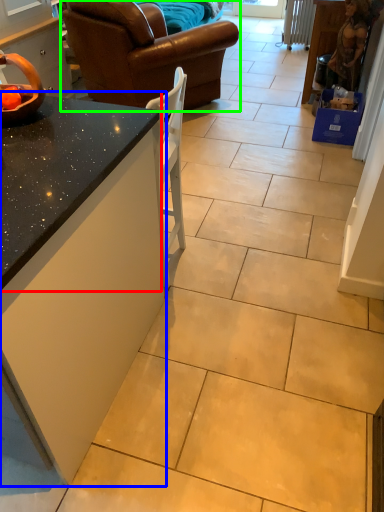
Question: Which is nearer to the countertop (highlighted by a red box)? countertop (highlighted by a blue box) or studio couch (highlighted by a green box).

Choices:
 (A) countertop
 (B) studio couch

Answer: (A)